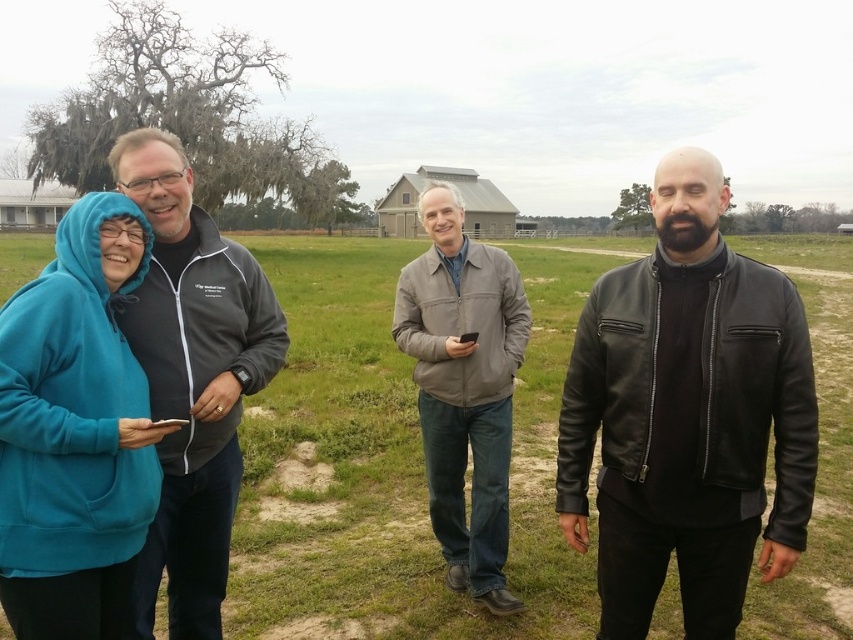
You are taking a photo of two points marked in the image. The first point is at coordinates point (115, 490) and the second point is at point (469, 307). Which point will appear larger in your photo?

Point (115, 490) is closer to the camera than point (469, 307), so it will appear larger in the photo.

You are a photographer trying to capture a group photo of the teal fleece at left and the gray leather jacket at center. Since you want to include both subjects in the frame, which direction should you move your camera to ensure both are visible?

Since the teal fleece at left is positioned on the left side of gray leather jacket at center, you should move your camera to the right to include both subjects in the frame.